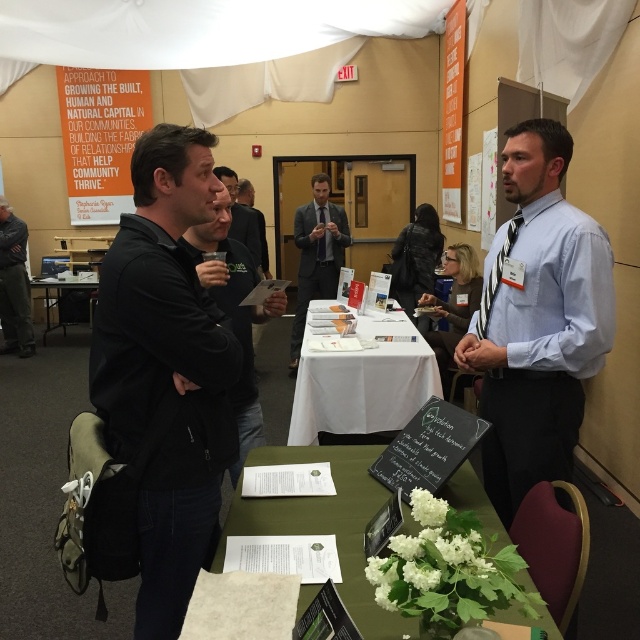
You are standing at the entrance of the event room and want to locate the green fabric table at center. According to the coordinates provided, where would you find the point at (324, 524)?

The point at (324, 524) is located on the green fabric table at center.

You are attending an event and need to place a name tag on the matte gray suit at center. Where should you place it relative to the white plastic table at center?

The matte gray suit at center is in front of the white plastic table at center, so you should place the name tag on the front side of the matte gray suit at center facing away from the table.